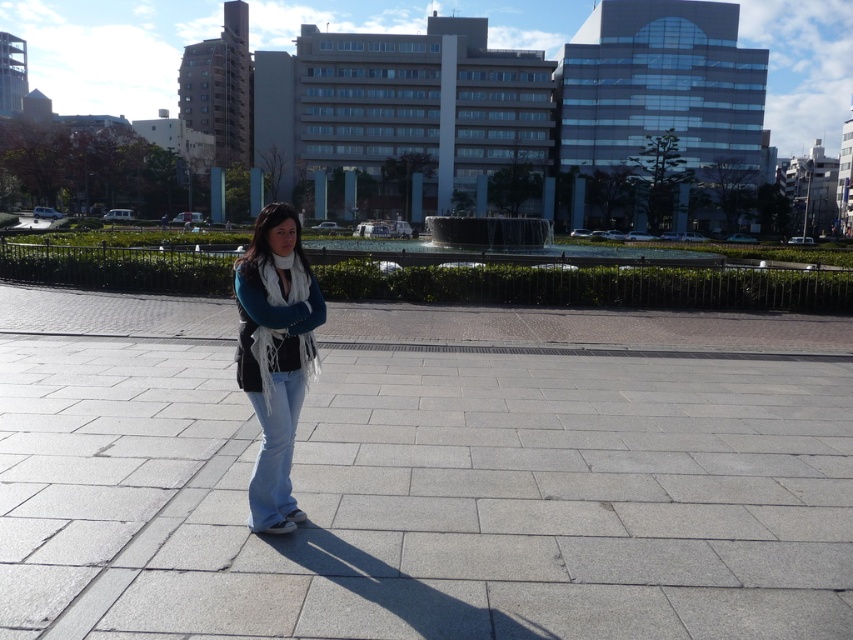
You are a fashion designer analyzing the urban scene. You need to determine the exact location of the denim jeans at center. What are their coordinates?

The denim jeans at center are located at coordinates point (276, 355).

You are a delivery person trying to navigate to the fountain in the middle ground. You are currently standing on the gray concrete pavement at center. To your left, there are denim jeans at center. Which direction should you turn to reach the fountain?

The gray concrete pavement at center is to the right of the denim jeans at center, so you should turn left to head toward the fountain.

You are a delivery robot that needs to navigate through the gray concrete pavement at center and the denim jeans at center. Which path should you choose to ensure safe passage?

The gray concrete pavement at center is wider than the denim jeans at center, so the robot should choose the gray concrete pavement at center for safe passage.